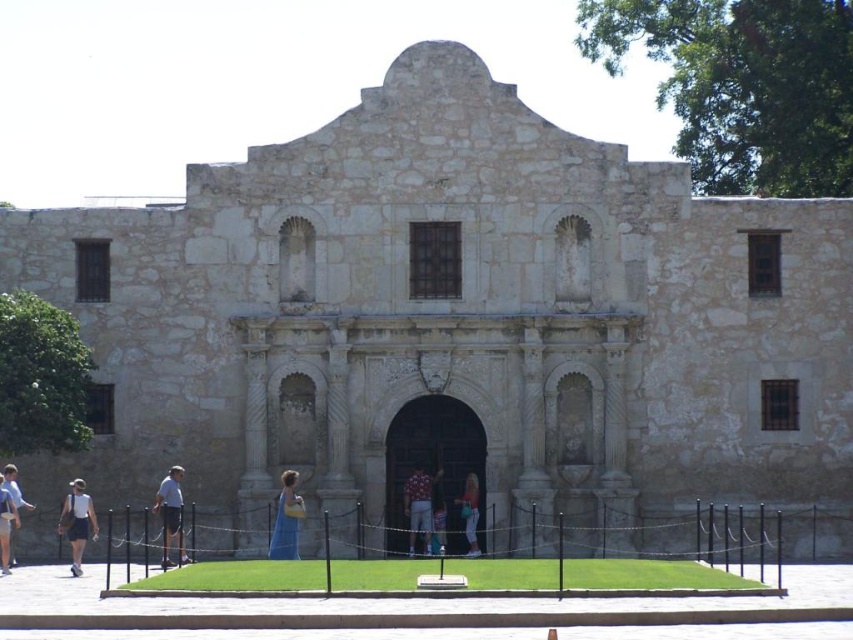
Question: Estimate the real-world distances between objects in this image. Which object is farther from the matte white dress at lower left?

Choices:
 (A) matte blue dress at center
 (B) light blue denim shorts at lower left
 (C) matte gray shorts at lower left
 (D) white cotton shorts at lower left

Answer: (A)

Question: Which of the following is the farthest from the observer?

Choices:
 (A) (6, 502)
 (B) (76, 509)
 (C) (281, 506)
 (D) (469, 548)

Answer: (D)

Question: Does white cotton shorts at lower left appear on the right side of matte gray shorts at lower left?

Choices:
 (A) yes
 (B) no

Answer: (A)

Question: Is blue denim dress at center wider than matte white dress at lower left?

Choices:
 (A) no
 (B) yes

Answer: (A)

Question: Which point is closer to the camera?

Choices:
 (A) blue denim dress at center
 (B) white cotton shorts at lower left
 (C) light blue dress at center
 (D) matte gray shorts at lower left

Answer: (B)

Question: Does matte blue dress at center come in front of light blue dress at center?

Choices:
 (A) no
 (B) yes

Answer: (B)